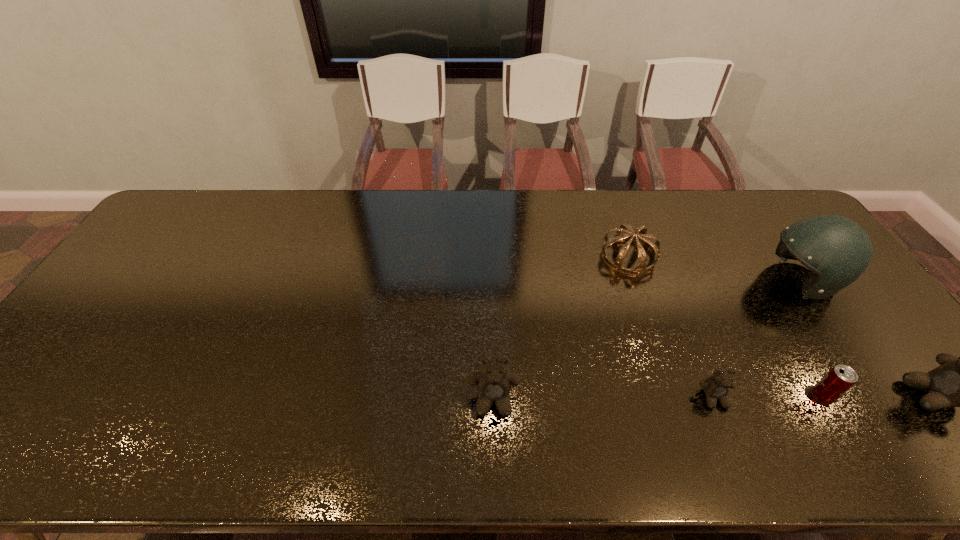
Where is `vacant spot to place a teddy bear on the left`? The image size is (960, 540). vacant spot to place a teddy bear on the left is located at coordinates [x=272, y=402].